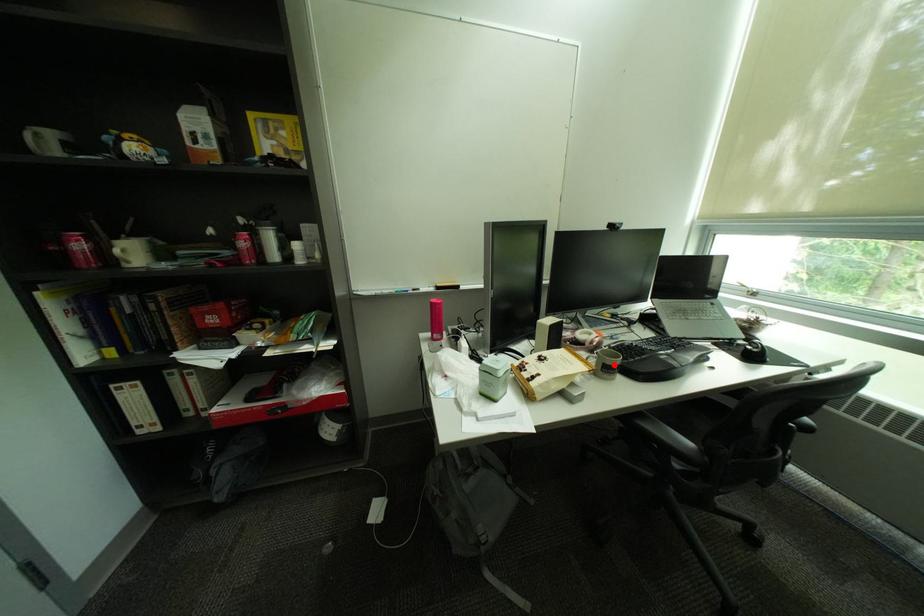
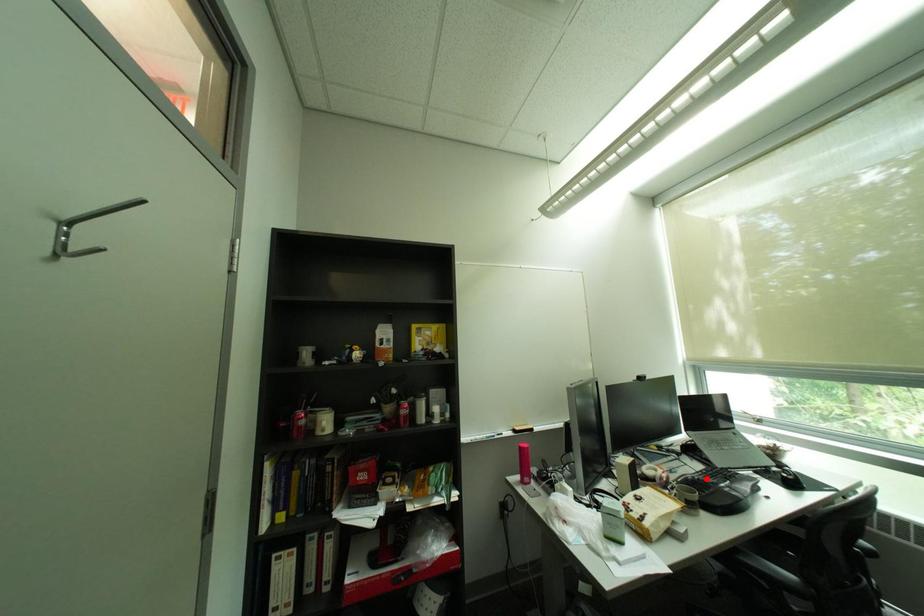
I am providing you with two images of the same scene from different viewpoints. A red point is marked on the first image and another point is marked on the second image. Is the red point in image1 aligned with the point shown in image2?

No